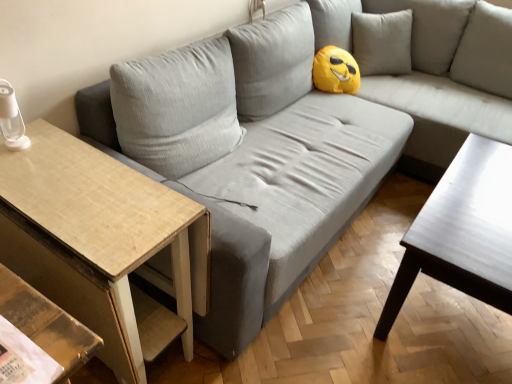
Describe the element at coordinates (462, 232) in the screenshot. I see `shiny dark wood coffee table at right` at that location.

Find the location of a particular element. The width and height of the screenshot is (512, 384). shiny dark wood coffee table at right is located at coordinates (462, 232).

Looking at this image, measure the distance between wooden textured table at left and camera.

36.94 inches.

Describe the element at coordinates (101, 244) in the screenshot. I see `wooden textured table at left` at that location.

The image size is (512, 384). Find the location of `wooden textured table at left`. wooden textured table at left is located at coordinates (101, 244).

Image resolution: width=512 pixels, height=384 pixels. Find the location of `shiny dark wood coffee table at right`. shiny dark wood coffee table at right is located at coordinates (462, 232).

Which object is positioned more to the left, wooden textured table at left or shiny dark wood coffee table at right?

wooden textured table at left is more to the left.

Is wooden textured table at left closer to camera compared to shiny dark wood coffee table at right?

That is True.

Considering the positions of points (177, 195) and (439, 191), is point (177, 195) farther from camera compared to point (439, 191)?

No, (177, 195) is in front of (439, 191).

From the image's perspective, which is above, wooden textured table at left or shiny dark wood coffee table at right?

From the image's view, shiny dark wood coffee table at right is above.

From a real-world perspective, is wooden textured table at left on shiny dark wood coffee table at right?

Yes, from a real-world perspective, wooden textured table at left is above shiny dark wood coffee table at right.

Which of these two, wooden textured table at left or shiny dark wood coffee table at right, is wider?

With larger width is wooden textured table at left.

Can you confirm if wooden textured table at left is taller than shiny dark wood coffee table at right?

Indeed, wooden textured table at left has a greater height compared to shiny dark wood coffee table at right.

Considering the sizes of wooden textured table at left and shiny dark wood coffee table at right in the image, is wooden textured table at left bigger or smaller than shiny dark wood coffee table at right?

Considering their sizes, wooden textured table at left takes up less space than shiny dark wood coffee table at right.

In the scene shown: Is shiny dark wood coffee table at right completely or partially inside wooden textured table at left?

No, shiny dark wood coffee table at right is not inside wooden textured table at left.

Based on the photo, is the surface of wooden textured table at left in direct contact with shiny dark wood coffee table at right?

wooden textured table at left and shiny dark wood coffee table at right are clearly separated.

Looking at this image, is shiny dark wood coffee table at right at the back of wooden textured table at left?

wooden textured table at left is not turned away from shiny dark wood coffee table at right.

Identify the location of coffee table that is above the wooden textured table at left (from the image's perspective). (462, 232).

Considering the relative positions of shiny dark wood coffee table at right and wooden textured table at left in the image provided, is shiny dark wood coffee table at right to the left of wooden textured table at left from the viewer's perspective?

In fact, shiny dark wood coffee table at right is to the right of wooden textured table at left.

Considering the positions of objects shiny dark wood coffee table at right and wooden textured table at left in the image provided, who is behind, shiny dark wood coffee table at right or wooden textured table at left?

Positioned behind is shiny dark wood coffee table at right.

Which is nearer, (415, 223) or (133, 308)?

The point (133, 308) is in front.

From the image's perspective, is shiny dark wood coffee table at right located beneath wooden textured table at left?

No, from the image's perspective, shiny dark wood coffee table at right is not beneath wooden textured table at left.

From a real-world perspective, is shiny dark wood coffee table at right physically above wooden textured table at left?

No, from a real-world perspective, shiny dark wood coffee table at right is not over wooden textured table at left

In terms of width, does shiny dark wood coffee table at right look wider or thinner when compared to wooden textured table at left?

Considering their sizes, shiny dark wood coffee table at right looks slimmer than wooden textured table at left.

Considering the sizes of objects shiny dark wood coffee table at right and wooden textured table at left in the image provided, who is taller, shiny dark wood coffee table at right or wooden textured table at left?

Standing taller between the two is wooden textured table at left.

Between shiny dark wood coffee table at right and wooden textured table at left, which one has larger size?

shiny dark wood coffee table at right is bigger.

Is shiny dark wood coffee table at right not within wooden textured table at left?

Indeed, shiny dark wood coffee table at right is completely outside wooden textured table at left.

Is shiny dark wood coffee table at right far from wooden textured table at left?

No, shiny dark wood coffee table at right is not far away from wooden textured table at left.

Is shiny dark wood coffee table at right looking in the opposite direction of wooden textured table at left?

That's not correct — shiny dark wood coffee table at right is not looking away from wooden textured table at left.

Can you tell me how much shiny dark wood coffee table at right and wooden textured table at left differ in facing direction?

0.172 degrees.

Where is `coffee table that is on the right side of wooden textured table at left`? coffee table that is on the right side of wooden textured table at left is located at coordinates (462, 232).

The height and width of the screenshot is (384, 512). What are the coordinates of `table in front of the shiny dark wood coffee table at right` in the screenshot? It's located at (101, 244).

Find the location of a particular element. Image resolution: width=512 pixels, height=384 pixels. table above the shiny dark wood coffee table at right (from a real-world perspective) is located at coordinates (101, 244).